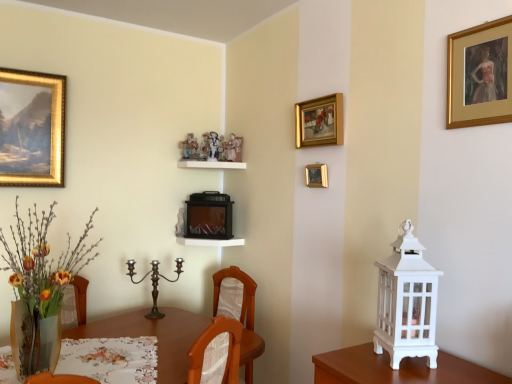
Question: From a real-world perspective, is gold-framed painting at upper center, placed as the 2th picture frame when sorted from front to back, above or below translucent glass vase at lower left?

Choices:
 (A) above
 (B) below

Answer: (A)

Question: Considering the positions of gold-framed painting at upper center, which appears as the second picture frame when viewed from the right, and translucent glass vase at lower left in the image, is gold-framed painting at upper center, which appears as the second picture frame when viewed from the right, wider or thinner than translucent glass vase at lower left?

Choices:
 (A) thin
 (B) wide

Answer: (A)

Question: Which object is positioned closest to the white glossy shelf at upper center, which appears as the first shelf when viewed from the top?

Choices:
 (A) translucent glass vase at lower left
 (B) gold metallic picture frame at upper center, which is counted as the 3th picture frame, starting from the right
 (C) polished bronze candle holder at center, marked as the second candle holder in a right-to-left arrangement
 (D) white painted wood lantern at right, which is the 1th candle holder from front to back
 (E) floral lace tablecloth at lower left

Answer: (C)

Question: Which is farther from the gold/golden frame at upper right, the 1th picture frame when ordered from right to left?

Choices:
 (A) gold metallic picture frame at upper center, which is counted as the first picture frame, starting from the left
 (B) polished bronze candle holder at center, which appears as the 1th candle holder when viewed from the left
 (C) translucent glass vase at lower left
 (D) brown wooden table at center
 (E) floral lace tablecloth at lower left

Answer: (B)